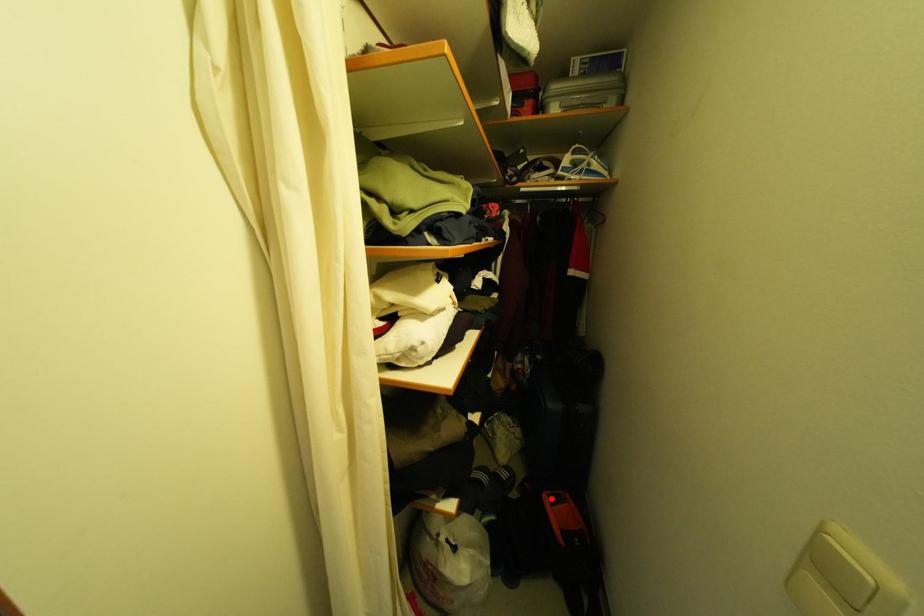
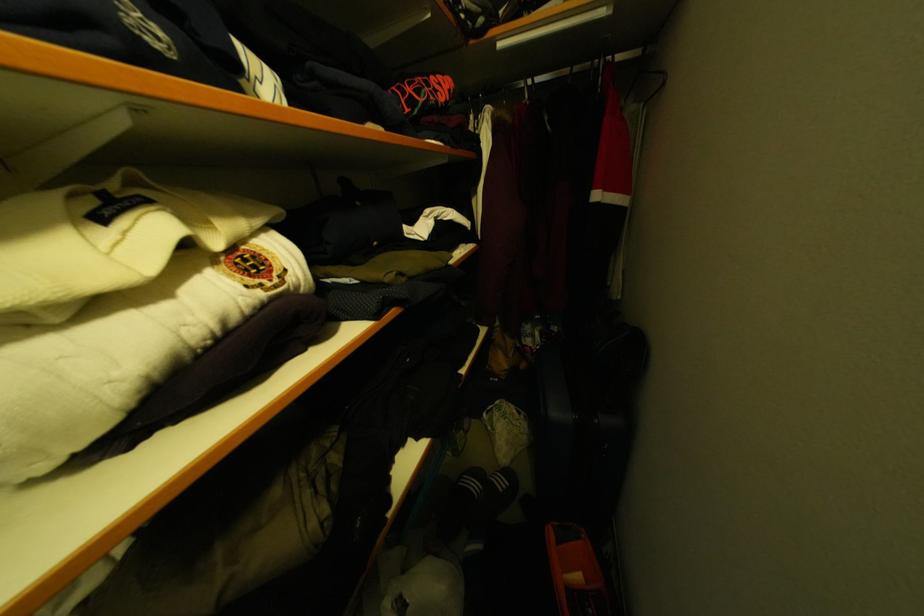
Question: I am providing you with two images of the same scene from different viewpoints. Given a red point in image1, look at the same physical point in image2. Is it:

Choices:
 (A) Closer to the viewpoint
 (B) Farther from the viewpoint

Answer: (B)